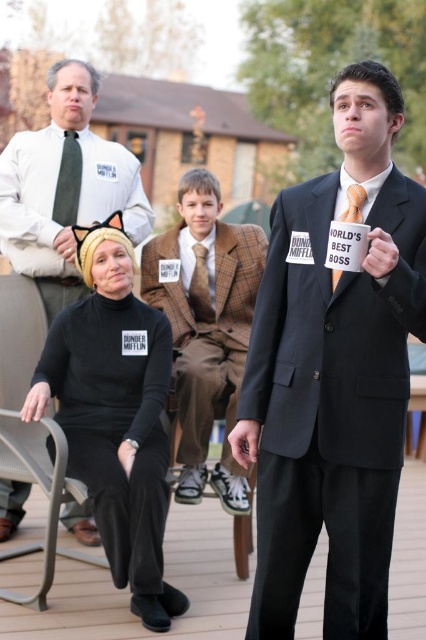
Question: Does black jersey at center appear on the right side of brown checkered tie at center?

Choices:
 (A) yes
 (B) no

Answer: (B)

Question: Does plaid wool suit at center have a greater width compared to green fabric tie at upper left?

Choices:
 (A) no
 (B) yes

Answer: (B)

Question: Which object is the closest to the black jersey at center?

Choices:
 (A) metallic gray chair at lower left
 (B) white shirt at upper left

Answer: (A)

Question: Is black jersey at center closer to camera compared to plaid wool suit at center?

Choices:
 (A) yes
 (B) no

Answer: (A)

Question: Which object is closer to the camera taking this photo?

Choices:
 (A) black jersey at center
 (B) white shirt at upper left

Answer: (A)

Question: Which object is closer to the camera taking this photo?

Choices:
 (A) plaid wool suit at center
 (B) brown checkered tie at center
 (C) green fabric tie at upper left
 (D) black jersey at center

Answer: (D)